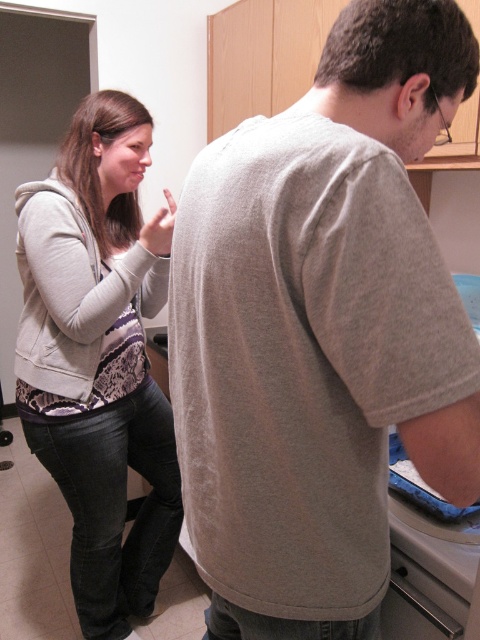
Which of these two, gray cotton t-shirt at center or light gray hoodie at left, stands taller?

light gray hoodie at left

Can you confirm if gray cotton t-shirt at center is smaller than light gray hoodie at left?

Correct, gray cotton t-shirt at center occupies less space than light gray hoodie at left.

This screenshot has width=480, height=640. I want to click on gray cotton t-shirt at center, so click(322, 330).